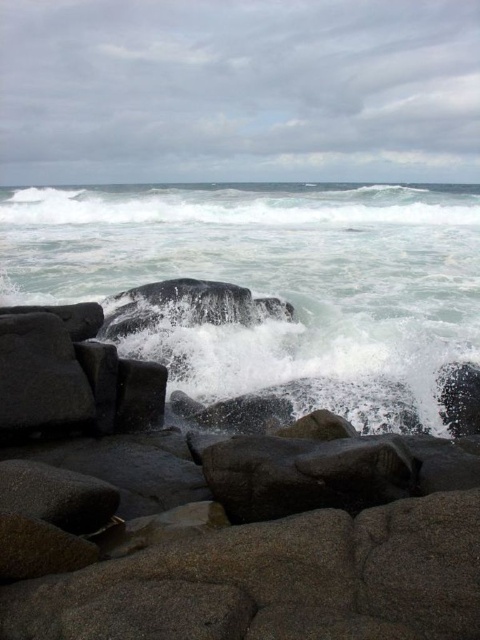
Question: Does gray granite rocks at lower center appear on the right side of white frothy water at center?

Choices:
 (A) no
 (B) yes

Answer: (A)

Question: Where is gray granite rocks at lower center located in relation to white frothy wave at upper center in the image?

Choices:
 (A) left
 (B) right

Answer: (A)

Question: Is smooth granite rocks at lower center below white frothy water at center?

Choices:
 (A) yes
 (B) no

Answer: (B)

Question: Which is farther from the white frothy wave at upper center?

Choices:
 (A) smooth granite rocks at lower center
 (B) gray granite rocks at lower center

Answer: (A)

Question: Which object appears farthest from the camera in this image?

Choices:
 (A) white frothy wave at upper center
 (B) smooth granite rocks at lower center

Answer: (B)

Question: Which object appears farthest from the camera in this image?

Choices:
 (A) gray granite rocks at lower center
 (B) smooth granite rocks at lower center
 (C) white frothy wave at upper center

Answer: (B)